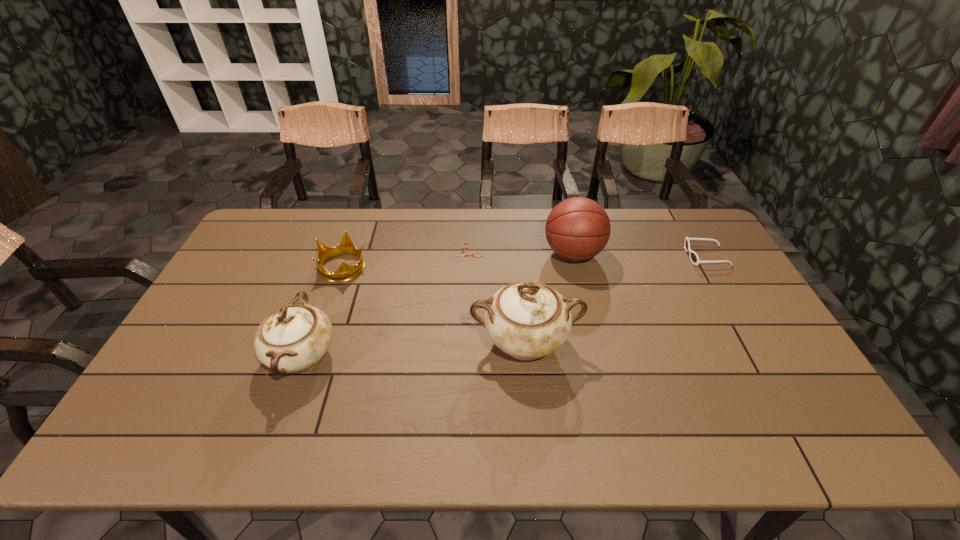
This screenshot has height=540, width=960. Identify the location of the left chinaware. (294, 338).

At what (x,y) coordinates should I click in order to perform the action: click on the taller chinaware. Please return your answer as a coordinate pair (x, y). The image size is (960, 540). Looking at the image, I should click on (526, 319).

Locate an element on the screen. The height and width of the screenshot is (540, 960). sunglasses is located at coordinates (694, 258).

Image resolution: width=960 pixels, height=540 pixels. I want to click on the rightmost object, so click(x=694, y=258).

The image size is (960, 540). Find the location of `the third shortest object`. the third shortest object is located at coordinates (345, 272).

Find the location of a particular element. Image resolution: width=960 pixels, height=540 pixels. basketball is located at coordinates (577, 229).

Locate an element on the screen. shears is located at coordinates (462, 254).

What are the coordinates of `vacant space located 0.290m on the right of the shorter chinaware` in the screenshot? It's located at (446, 356).

You are a GUI agent. You are given a task and a screenshot of the screen. Output one action in this format:
    pyautogui.click(x=<x>, y=<y>)
    Task: Click on the free location located on the left of the taller chinaware
    This screenshot has width=960, height=540.
    Given the screenshot: What is the action you would take?
    pyautogui.click(x=354, y=342)

Locate an element on the screen. This screenshot has width=960, height=540. vacant position located 0.230m with the lenses of the sunglasses facing outward is located at coordinates (618, 256).